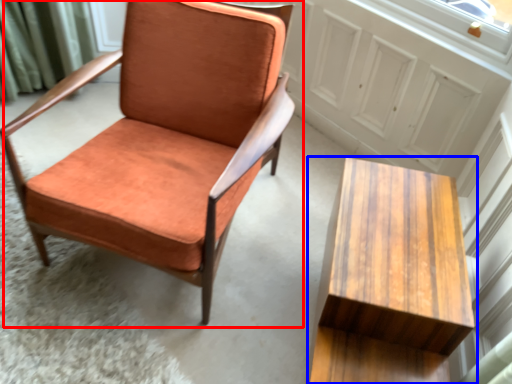
Question: Which of the following is the closest to the observer, chair (highlighted by a red box) or table (highlighted by a blue box)?

Choices:
 (A) chair
 (B) table

Answer: (B)